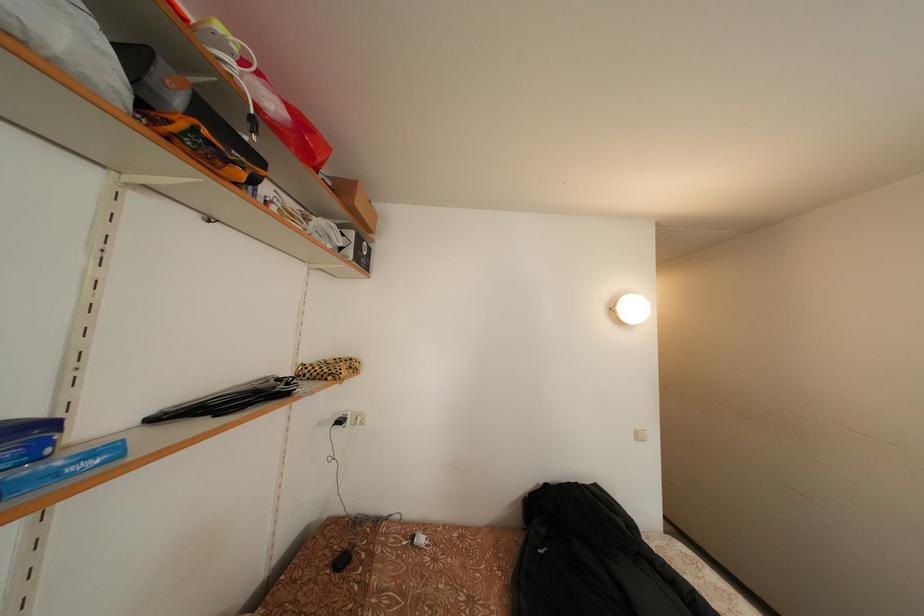
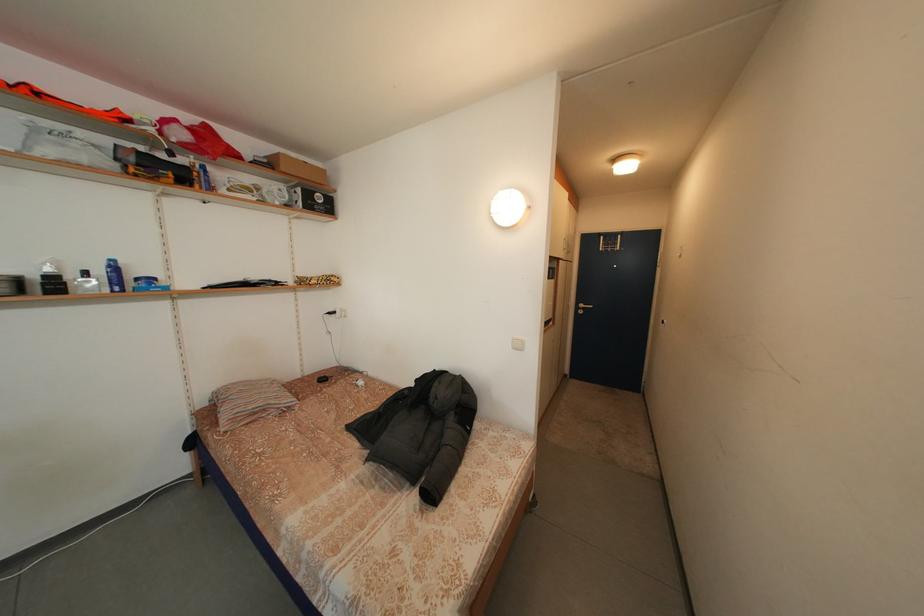
The point at (368, 209) is marked in the first image. Where is the corresponding point in the second image?

(292, 175)